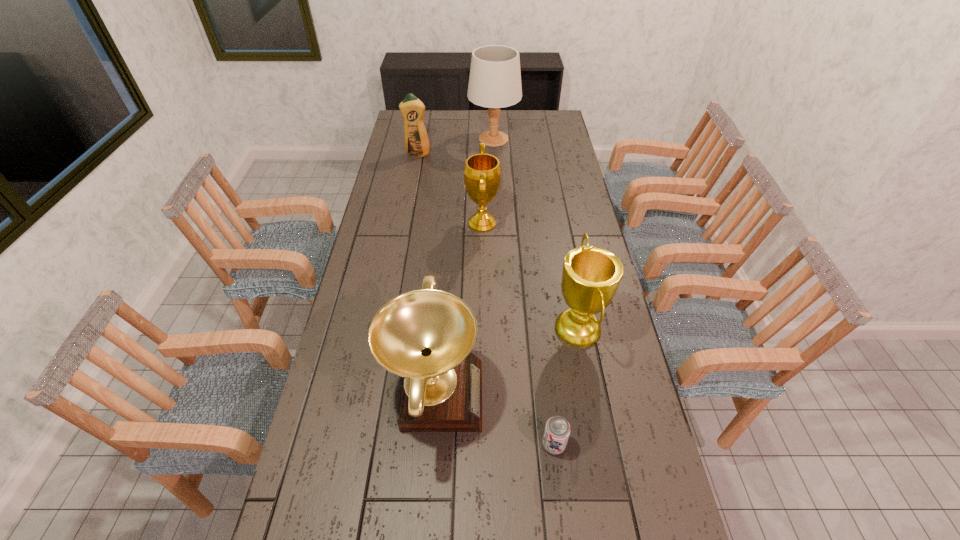
What are the coordinates of `blank space located on the shiny surface of the rightmost object` in the screenshot? It's located at (517, 329).

Image resolution: width=960 pixels, height=540 pixels. I want to click on vacant space located on the shiny surface of the rightmost object, so click(439, 329).

Identify the location of vacant region located 0.300m on the shiny surface of the rightmost object. (x=457, y=329).

Where is `free space located 0.270m on the back of the shortest object`? free space located 0.270m on the back of the shortest object is located at coordinates (542, 348).

Where is `object that is at the far edge`? The height and width of the screenshot is (540, 960). object that is at the far edge is located at coordinates (495, 79).

This screenshot has width=960, height=540. Identify the location of object that is at the left edge. (416, 139).

The height and width of the screenshot is (540, 960). I want to click on object located in the right edge section of the desktop, so click(x=591, y=275).

Image resolution: width=960 pixels, height=540 pixels. I want to click on free space at the far edge of the desktop, so [434, 129].

Find the location of a particular element. The height and width of the screenshot is (540, 960). vacant space at the left edge of the desktop is located at coordinates (406, 239).

In the image, there is a desktop. At what (x,y) coordinates should I click in order to perform the action: click on free region at the right edge. Please return your answer as a coordinate pair (x, y). The height and width of the screenshot is (540, 960). Looking at the image, I should click on (646, 446).